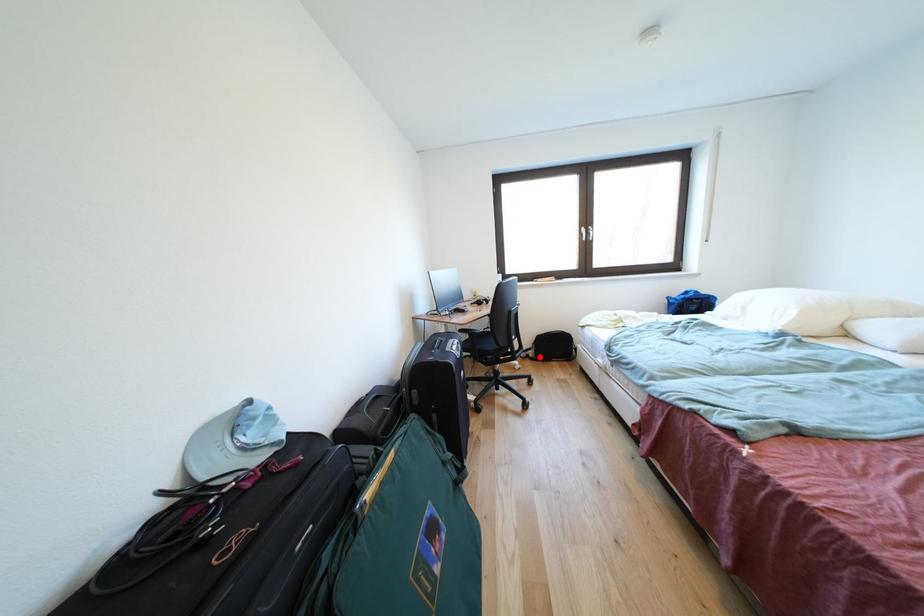
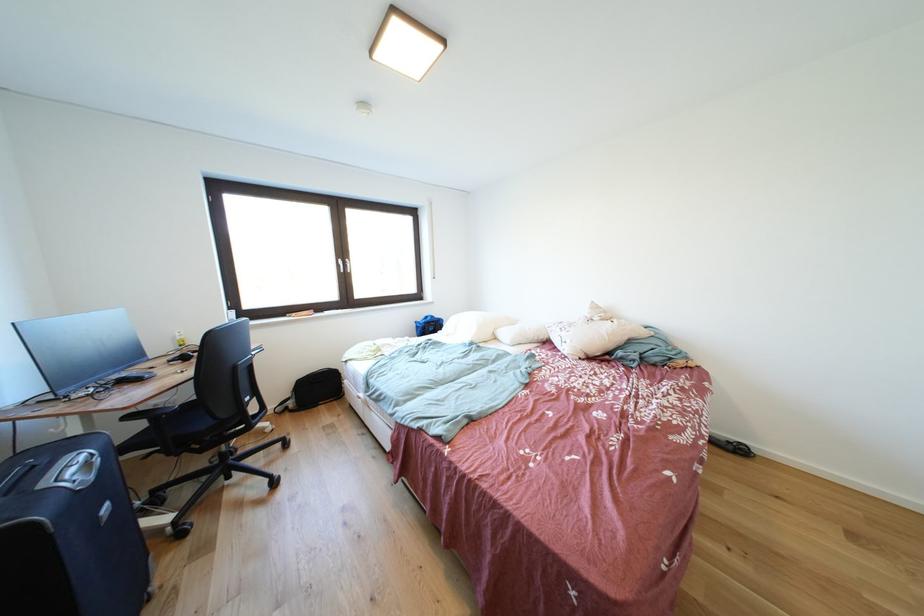
Question: I am providing you with two images of the same scene from different viewpoints. A red point is shown in image1. For the corresponding object point in image2, is it positioned nearer or farther from the camera?

Choices:
 (A) Nearer
 (B) Farther

Answer: (A)